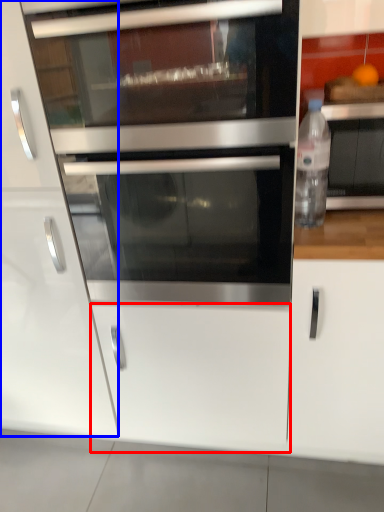
Question: Which point is further to the camera, drawer (highlighted by a red box) or cabinetry (highlighted by a blue box)?

Choices:
 (A) drawer
 (B) cabinetry

Answer: (A)